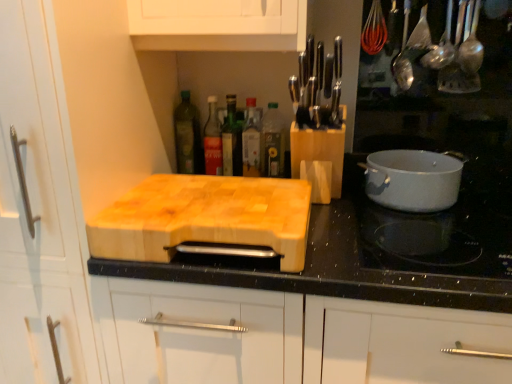
The image size is (512, 384). What do you see at coordinates (251, 140) in the screenshot?
I see `clear glass bottle at center, the fourth bottle when ordered from left to right` at bounding box center [251, 140].

The width and height of the screenshot is (512, 384). Identify the location of green glass bottle at center, arranged as the 3th bottle when viewed from the right. (232, 141).

Describe the element at coordinates (232, 141) in the screenshot. The height and width of the screenshot is (384, 512). I see `green glass bottle at center, arranged as the 3th bottle when viewed from the right` at that location.

The height and width of the screenshot is (384, 512). What do you see at coordinates (380, 248) in the screenshot?
I see `wooden cutting board at center` at bounding box center [380, 248].

What do you see at coordinates (212, 141) in the screenshot? The height and width of the screenshot is (384, 512). I see `matte glass wine at center, positioned as the fourth bottle in right-to-left order` at bounding box center [212, 141].

What are the coordinates of `natural wood cutting board at center` in the screenshot? It's located at pyautogui.click(x=206, y=219).

Find the location of a particular element. This screenshot has height=384, width=512. clear glass bottle at center, the fourth bottle when ordered from left to right is located at coordinates (251, 140).

Are clear glass bottle at center, the fourth bottle when ordered from left to right, and matte glass wine at center, the 2th bottle in the left-to-right sequence, located far from each other?

Actually, clear glass bottle at center, the fourth bottle when ordered from left to right, and matte glass wine at center, the 2th bottle in the left-to-right sequence, are a little close together.

From a real-world perspective, who is located higher, clear glass bottle at center, acting as the 2th bottle starting from the right, or matte glass wine at center, positioned as the fourth bottle in right-to-left order?

From a 3D spatial view, matte glass wine at center, positioned as the fourth bottle in right-to-left order, is above.

How far apart are clear glass bottle at center, the fourth bottle when ordered from left to right, and matte glass wine at center, the 2th bottle in the left-to-right sequence?

clear glass bottle at center, the fourth bottle when ordered from left to right, is 4.04 inches away from matte glass wine at center, the 2th bottle in the left-to-right sequence.

From a real-world perspective, is clear glass bottle at center, the fourth bottle when ordered from left to right, below white glossy pot at right?

Actually, clear glass bottle at center, the fourth bottle when ordered from left to right, is physically above white glossy pot at right in the real world.

Is clear glass bottle at center, acting as the 2th bottle starting from the right, to the right of white glossy pot at right from the viewer's perspective?

No, clear glass bottle at center, acting as the 2th bottle starting from the right, is not to the right of white glossy pot at right.

Considering the sizes of objects clear glass bottle at center, acting as the 2th bottle starting from the right, and white glossy pot at right in the image provided, who is taller, clear glass bottle at center, acting as the 2th bottle starting from the right, or white glossy pot at right?

Standing taller between the two is clear glass bottle at center, acting as the 2th bottle starting from the right.

Is clear glass bottle at center, the fourth bottle when ordered from left to right, positioned far away from white glossy pot at right?

No, clear glass bottle at center, the fourth bottle when ordered from left to right, is not far from white glossy pot at right.

From the image's perspective, which object appears higher, green glass bottle at upper center, which is the first bottle from left to right, or natural wood cutting board at center?

green glass bottle at upper center, which is the first bottle from left to right.

Is green glass bottle at upper center, which is the first bottle from left to right, at the right side of natural wood cutting board at center?

Yes.

Are green glass bottle at upper center, which is the first bottle from left to right, and natural wood cutting board at center far apart?

green glass bottle at upper center, which is the first bottle from left to right, is near natural wood cutting board at center, not far away.

Do you think green glass bottle at upper center, arranged as the 5th bottle when viewed from the right, is within natural wood cutting board at center, or outside of it?

green glass bottle at upper center, arranged as the 5th bottle when viewed from the right, is spatially positioned inside natural wood cutting board at center.

Is matte glass wine at center, the 2th bottle in the left-to-right sequence, to the left or to the right of clear glass bottle at center, the fourth bottle when ordered from left to right, in the image?

Based on their positions, matte glass wine at center, the 2th bottle in the left-to-right sequence, is located to the left of clear glass bottle at center, the fourth bottle when ordered from left to right.

Between matte glass wine at center, positioned as the fourth bottle in right-to-left order, and clear glass bottle at center, acting as the 2th bottle starting from the right, which one has larger width?

clear glass bottle at center, acting as the 2th bottle starting from the right, is wider.

Is matte glass wine at center, positioned as the fourth bottle in right-to-left order, located outside clear glass bottle at center, the fourth bottle when ordered from left to right?

Yes, matte glass wine at center, positioned as the fourth bottle in right-to-left order, is outside of clear glass bottle at center, the fourth bottle when ordered from left to right.

Which of these two, matte glass wine at center, the 2th bottle in the left-to-right sequence, or clear glass bottle at center, acting as the 2th bottle starting from the right, stands taller?

matte glass wine at center, the 2th bottle in the left-to-right sequence.

Is white glossy pot at right oriented towards natural wood cutting board at center?

No, white glossy pot at right is not oriented towards natural wood cutting board at center.

Which object is positioned more to the right, white glossy pot at right or natural wood cutting board at center?

white glossy pot at right is more to the right.

Is white glossy pot at right far away from natural wood cutting board at center?

white glossy pot at right is actually quite close to natural wood cutting board at center.

Is green glass bottle at center, arranged as the 3th bottle when viewed from the right, positioned beyond the bounds of clear glass bottle at center, the 5th bottle when ordered from left to right?

green glass bottle at center, arranged as the 3th bottle when viewed from the right, lies outside clear glass bottle at center, the 5th bottle when ordered from left to right,'s area.

Is green glass bottle at center, arranged as the 3th bottle when viewed from the right, further to camera compared to clear glass bottle at center, the 5th bottle when ordered from left to right?

Yes, green glass bottle at center, arranged as the 3th bottle when viewed from the right, is further from the viewer.

From a real-world perspective, is green glass bottle at center, which is the third bottle in left-to-right order, on clear glass bottle at center, the 5th bottle when ordered from left to right?

Yes, from a real-world perspective, green glass bottle at center, which is the third bottle in left-to-right order, is above clear glass bottle at center, the 5th bottle when ordered from left to right.

Considering the positions of objects green glass bottle at center, arranged as the 3th bottle when viewed from the right, and clear glass bottle at center, the first bottle in the right-to-left sequence, in the image provided, who is more to the left, green glass bottle at center, arranged as the 3th bottle when viewed from the right, or clear glass bottle at center, the first bottle in the right-to-left sequence,?

green glass bottle at center, arranged as the 3th bottle when viewed from the right, is more to the left.

Is green glass bottle at upper center, which is the first bottle from left to right, at the back of white glossy pot at right?

No, white glossy pot at right is not facing the opposite direction of green glass bottle at upper center, which is the first bottle from left to right.

Which of these two, white glossy pot at right or green glass bottle at upper center, which is the first bottle from left to right, is smaller?

green glass bottle at upper center, which is the first bottle from left to right.

Is point (411, 158) more distant than point (189, 111)?

No, it is in front of (189, 111).

Is white glossy pot at right shorter than green glass bottle at upper center, which is the first bottle from left to right?

Correct, white glossy pot at right is not as tall as green glass bottle at upper center, which is the first bottle from left to right.

There is a matte glass wine at center, positioned as the fourth bottle in right-to-left order. Where is `the 2nd bottle below it (from the image's perspective)`? The width and height of the screenshot is (512, 384). the 2nd bottle below it (from the image's perspective) is located at coordinates (251, 140).

Find the location of a particular element. This screenshot has width=512, height=384. the 2nd bottle located above the white glossy pot at right (from a real-world perspective) is located at coordinates (251, 140).

Looking at the image, which one is located closer to white glossy pot at right, natural wood cutting board at center or white glossy pot at right?

white glossy pot at right.

Looking at the image, which one is located closer to green glass bottle at center, which is the third bottle in left-to-right order, natural wood cutting board at center or green glass bottle at upper center, which is the first bottle from left to right?

Based on the image, green glass bottle at upper center, which is the first bottle from left to right, appears to be nearer to green glass bottle at center, which is the third bottle in left-to-right order.

From the image, which object appears to be nearer to green glass bottle at upper center, arranged as the 5th bottle when viewed from the right, green glass bottle at center, which is the third bottle in left-to-right order, or natural wood cutting board at center?

green glass bottle at center, which is the third bottle in left-to-right order.

Considering their positions, is matte glass wine at center, positioned as the fourth bottle in right-to-left order, positioned further to natural wood cutting board at center than clear glass bottle at center, the fourth bottle when ordered from left to right?

matte glass wine at center, positioned as the fourth bottle in right-to-left order.

Consider the image. Estimate the real-world distances between objects in this image. Which object is closer to clear glass bottle at center, acting as the 2th bottle starting from the right, white glossy pot at right or green glass bottle at center, which is the third bottle in left-to-right order?

Based on the image, green glass bottle at center, which is the third bottle in left-to-right order, appears to be nearer to clear glass bottle at center, acting as the 2th bottle starting from the right.

Based on the photo, when comparing their distances from white glossy pot at right, does wooden cutting board at center or green glass bottle at center, which is the third bottle in left-to-right order, seem closer?

The object closer to white glossy pot at right is wooden cutting board at center.

Which object lies further to the anchor point green glass bottle at upper center, which is the first bottle from left to right, clear glass bottle at center, the 5th bottle when ordered from left to right, or matte glass wine at center, positioned as the fourth bottle in right-to-left order?

Based on the image, clear glass bottle at center, the 5th bottle when ordered from left to right, appears to be further to green glass bottle at upper center, which is the first bottle from left to right.

From the image, which object appears to be farther from clear glass bottle at center, the fourth bottle when ordered from left to right, clear glass bottle at center, the 5th bottle when ordered from left to right, or white glossy pot at right?

Among the two, white glossy pot at right is located further to clear glass bottle at center, the fourth bottle when ordered from left to right.

Locate an element on the screen. The image size is (512, 384). cutting board between matte glass wine at center, the 2th bottle in the left-to-right sequence, and white glossy pot at right is located at coordinates (206, 219).

I want to click on countertop between natural wood cutting board at center and white glossy pot at right from left to right, so click(380, 248).

Identify the location of countertop between natural wood cutting board at center and white glossy pot at right from left to right. The width and height of the screenshot is (512, 384). (380, 248).

Identify the location of cutting board between green glass bottle at upper center, which is the first bottle from left to right, and wooden cutting board at center from top to bottom. Image resolution: width=512 pixels, height=384 pixels. (206, 219).